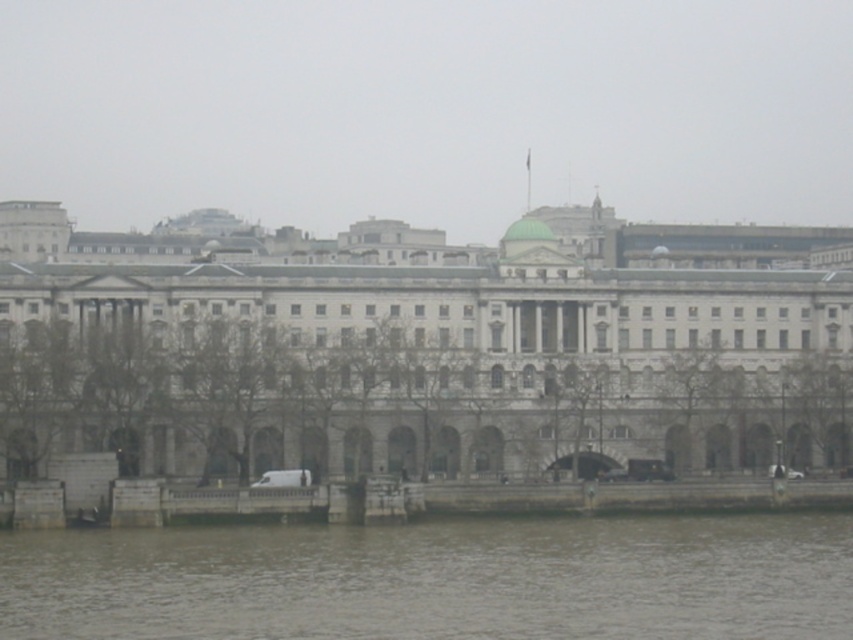
Which is above, white stone building at center or gray water at lower center?

white stone building at center is higher up.

The image size is (853, 640). I want to click on white stone building at center, so click(428, 355).